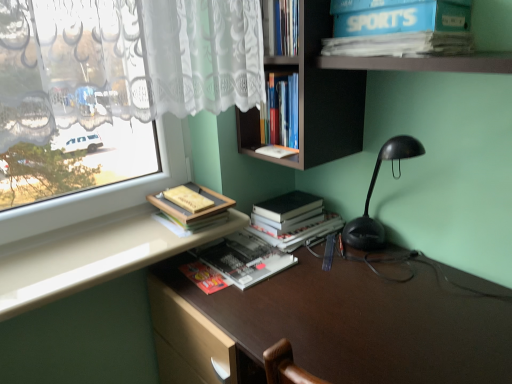
Locate an element on the screen. The image size is (512, 384). free location to the right of hardcover book at center, which appears as the 1th book when ordered from the bottom is located at coordinates (331, 278).